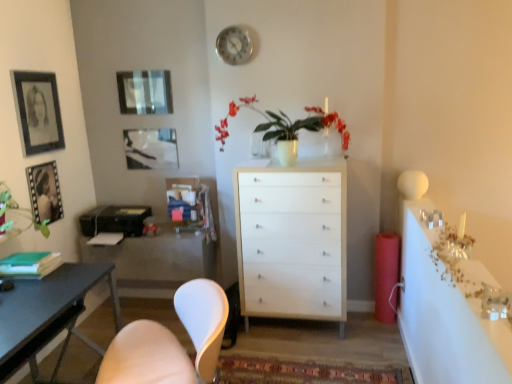
Question: Is white wood chest of drawers at center surrounding white matte chair at lower left?

Choices:
 (A) no
 (B) yes

Answer: (A)

Question: Is white wood chest of drawers at center taller than white matte chair at lower left?

Choices:
 (A) yes
 (B) no

Answer: (A)

Question: Considering the relative sizes of white wood chest of drawers at center and white matte chair at lower left in the image provided, is white wood chest of drawers at center thinner than white matte chair at lower left?

Choices:
 (A) no
 (B) yes

Answer: (B)

Question: Is white wood chest of drawers at center at the right side of white matte chair at lower left?

Choices:
 (A) yes
 (B) no

Answer: (A)

Question: Can you see white wood chest of drawers at center touching white matte chair at lower left?

Choices:
 (A) yes
 (B) no

Answer: (B)

Question: Is white wood chest of drawers at center not near white matte chair at lower left?

Choices:
 (A) no
 (B) yes

Answer: (B)

Question: Is white wood chest of drawers at center turned away from metallic silver clock at upper center?

Choices:
 (A) no
 (B) yes

Answer: (A)

Question: Does white wood chest of drawers at center come behind metallic silver clock at upper center?

Choices:
 (A) no
 (B) yes

Answer: (A)

Question: Does white wood chest of drawers at center appear on the right side of metallic silver clock at upper center?

Choices:
 (A) no
 (B) yes

Answer: (B)

Question: Does white wood chest of drawers at center have a larger size compared to metallic silver clock at upper center?

Choices:
 (A) yes
 (B) no

Answer: (A)

Question: Does white wood chest of drawers at center have a lesser height compared to metallic silver clock at upper center?

Choices:
 (A) yes
 (B) no

Answer: (B)

Question: Does white wood chest of drawers at center have a smaller size compared to metallic silver clock at upper center?

Choices:
 (A) no
 (B) yes

Answer: (A)

Question: Would you say white glossy vase at center is part of metallic silver clock at upper center's contents?

Choices:
 (A) yes
 (B) no

Answer: (B)